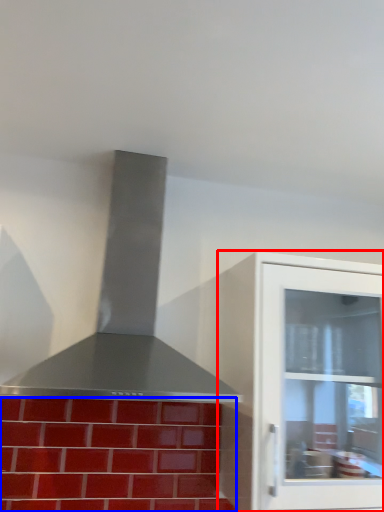
Question: Which object is closer to the camera taking this photo, cabinetry (highlighted by a red box) or brickwork (highlighted by a blue box)?

Choices:
 (A) cabinetry
 (B) brickwork

Answer: (A)